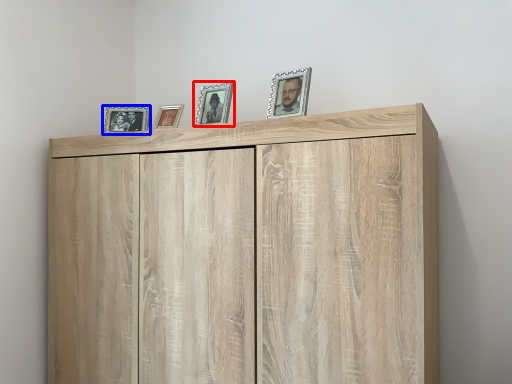
Question: Which object is further to the camera taking this photo, picture frame (highlighted by a red box) or picture frame (highlighted by a blue box)?

Choices:
 (A) picture frame
 (B) picture frame

Answer: (B)